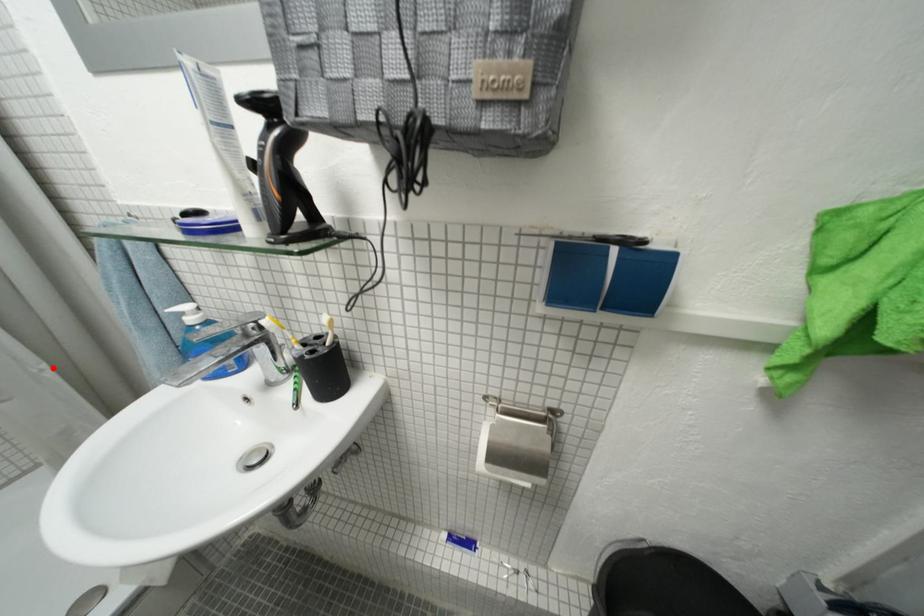
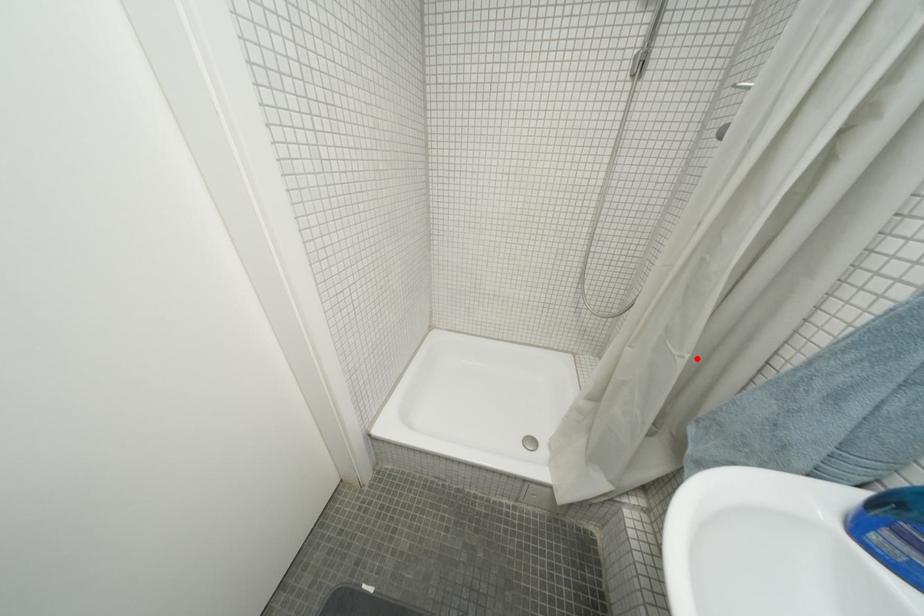
I am providing you with two images of the same scene from different viewpoints. A red point is marked on the first image and another point is marked on the second image. Do the highlighted points in image1 and image2 indicate the same real-world spot?

Yes